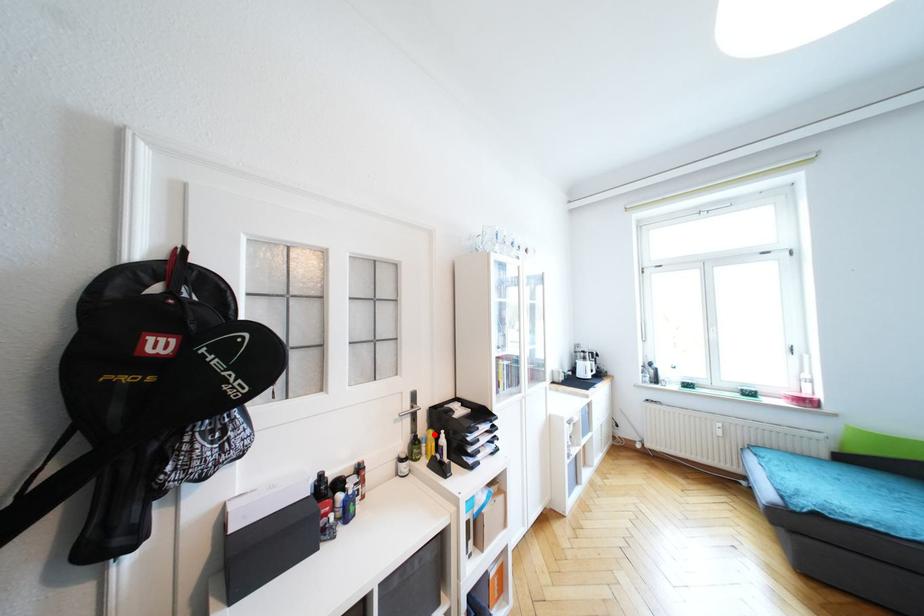
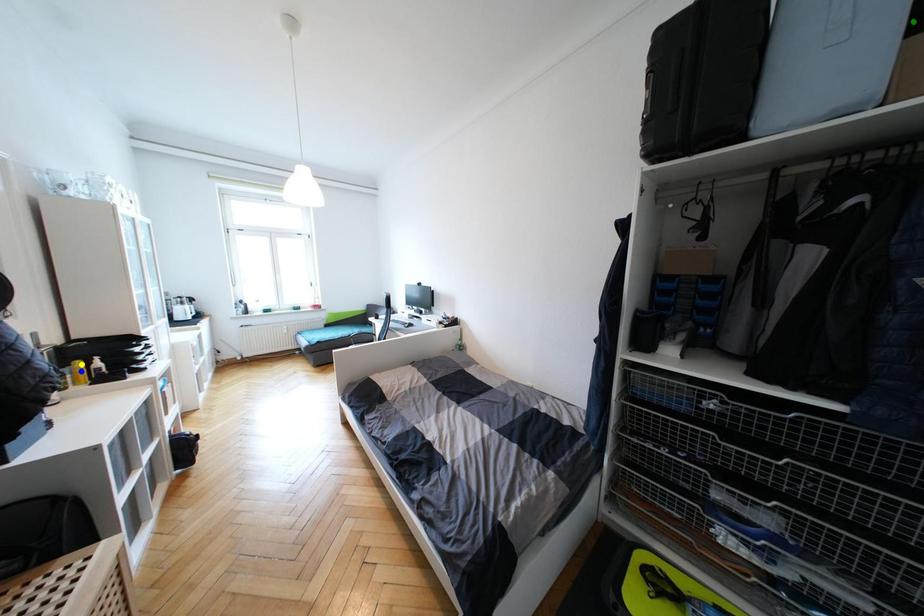
Question: I am providing you with two images of the same scene from different viewpoints. A red point is marked on the first image. You are given multiple points on the second image. Which point in image 2 represents the same 3d spot as the red point in image 1?

Choices:
 (A) yellow point
 (B) green point
 (C) blue point

Answer: (A)